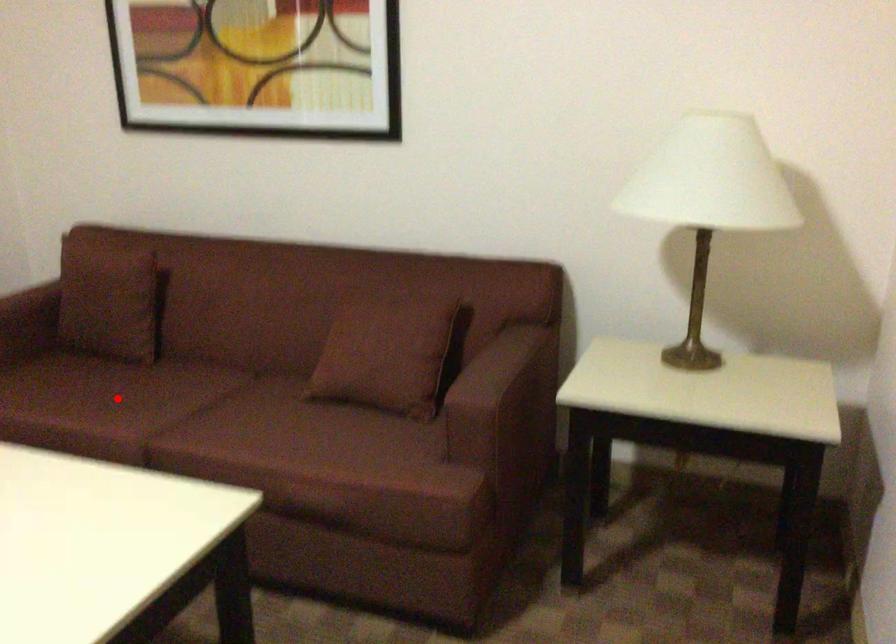
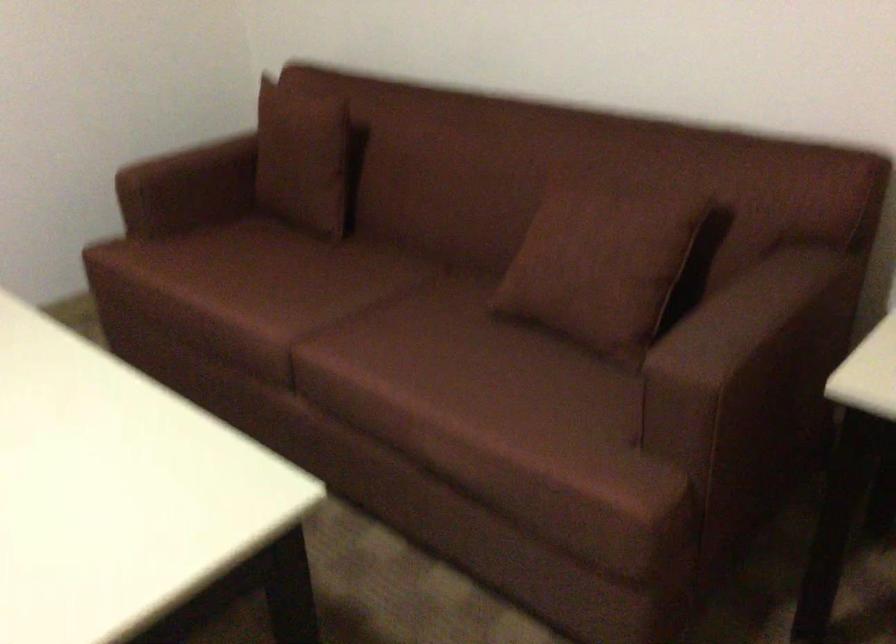
Question: A red point is marked in image1. In image2, is the corresponding 3D point closer to the camera or farther? Reply with the corresponding letter.

Choices:
 (A) The corresponding 3D point is closer.
 (B) The corresponding 3D point is farther.

Answer: (A)